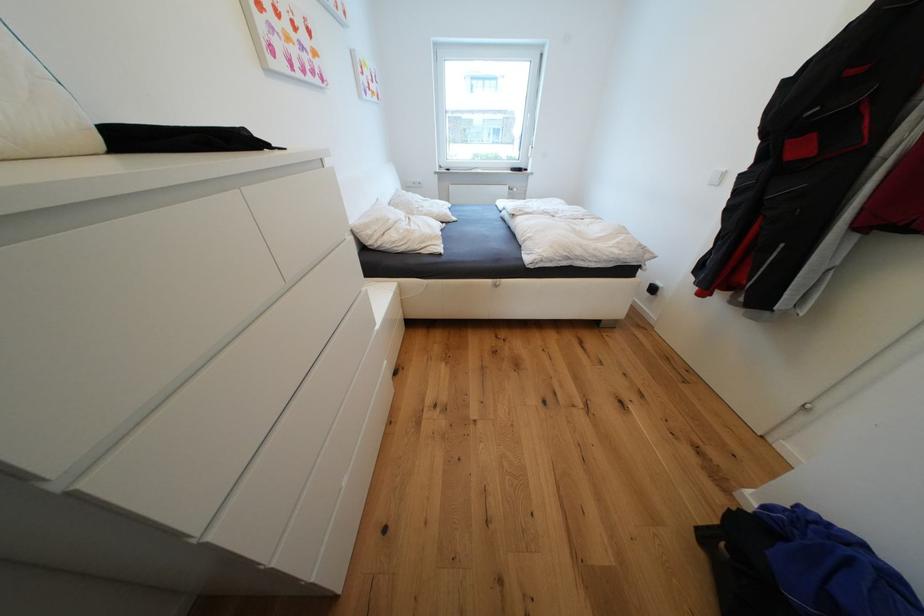
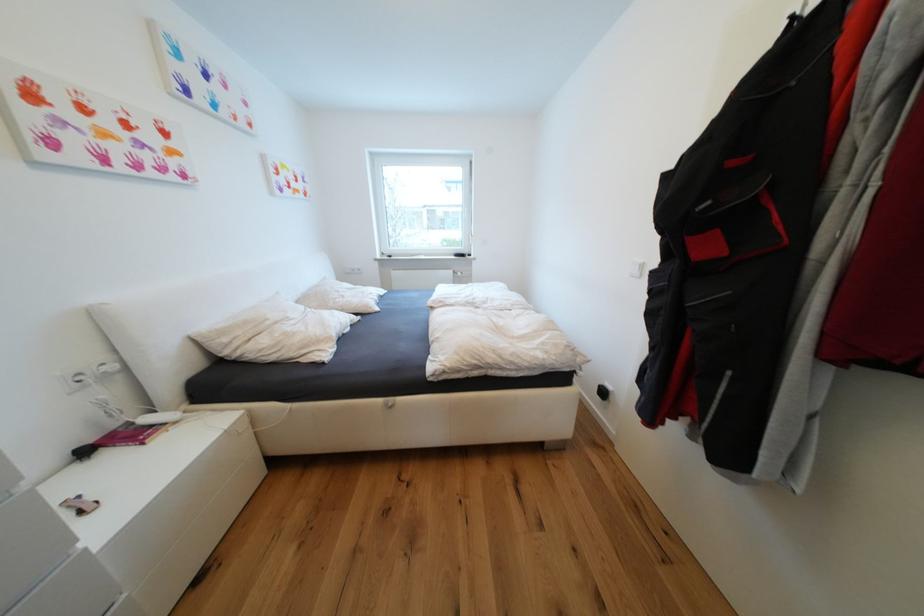
In the second image, find the point that corresponds to [377,233] in the first image.

(233, 341)